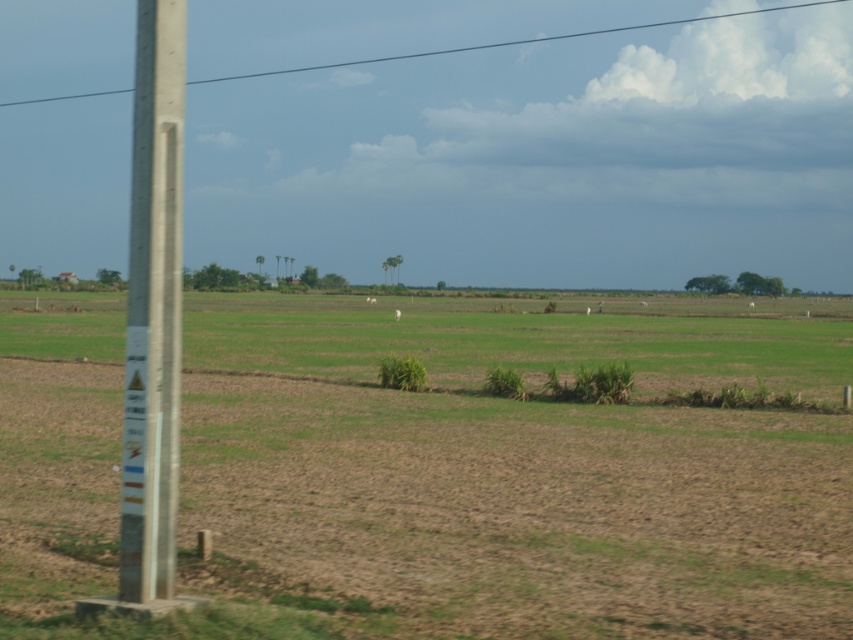
From the picture: Is brown soil at center further to camera compared to concrete pole at left?

No, it is not.

Image resolution: width=853 pixels, height=640 pixels. Describe the element at coordinates (440, 468) in the screenshot. I see `brown soil at center` at that location.

What are the coordinates of `brown soil at center` in the screenshot? It's located at (440, 468).

Which is in front, point (573, 307) or point (352, 65)?

Positioned in front is point (573, 307).

This screenshot has width=853, height=640. Describe the element at coordinates (440, 468) in the screenshot. I see `brown soil at center` at that location.

Who is more forward, (387, 541) or (656, 24)?

Point (387, 541) is in front.

Locate an element on the screen. The image size is (853, 640). brown soil at center is located at coordinates (440, 468).

Is concrete pole at left to the right of smooth concrete power line at upper center from the viewer's perspective?

Indeed, concrete pole at left is positioned on the right side of smooth concrete power line at upper center.

Is point (173, 278) behind point (519, 42)?

No, it is in front of (519, 42).

The image size is (853, 640). I want to click on concrete pole at left, so click(154, 307).